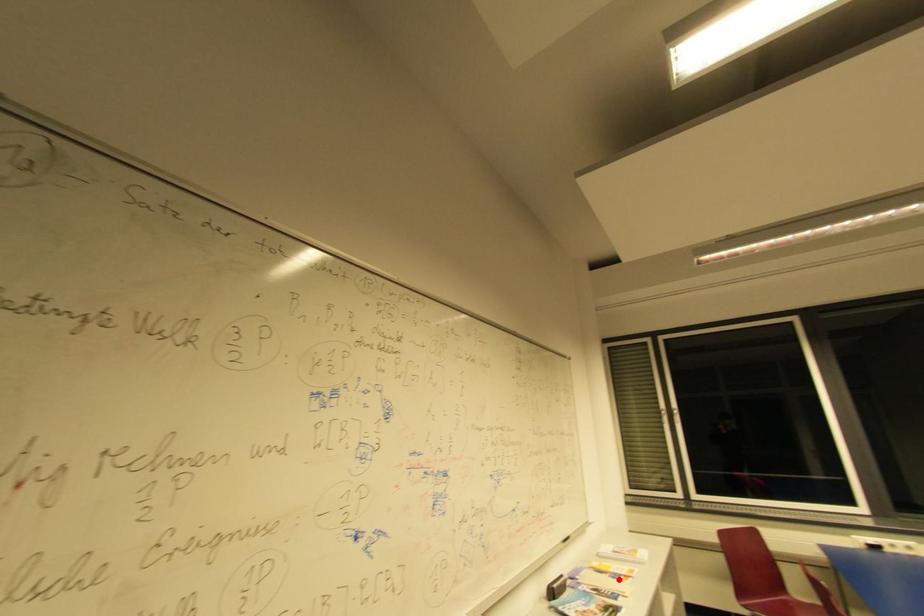
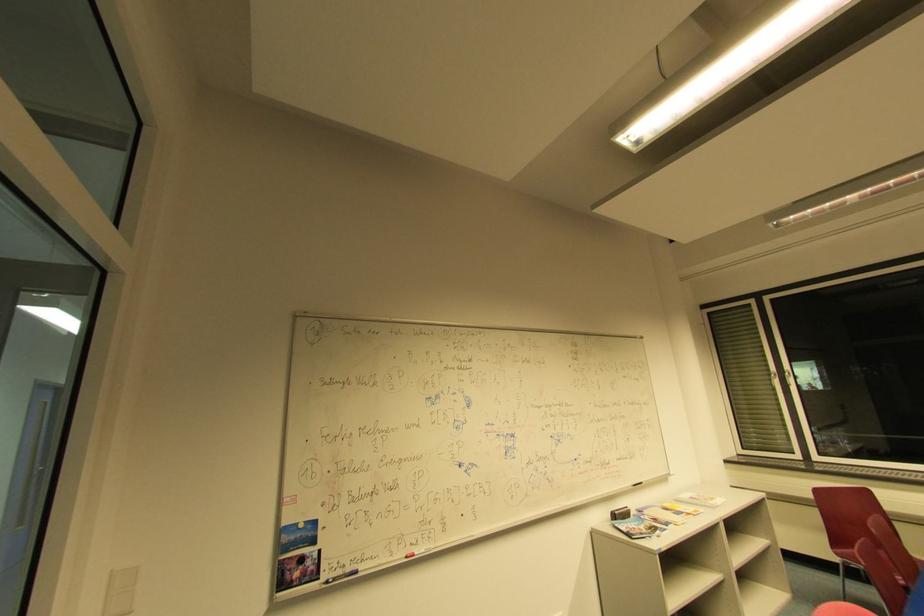
Find the pixel in the second image that matches the highlighted location in the first image.

(679, 515)